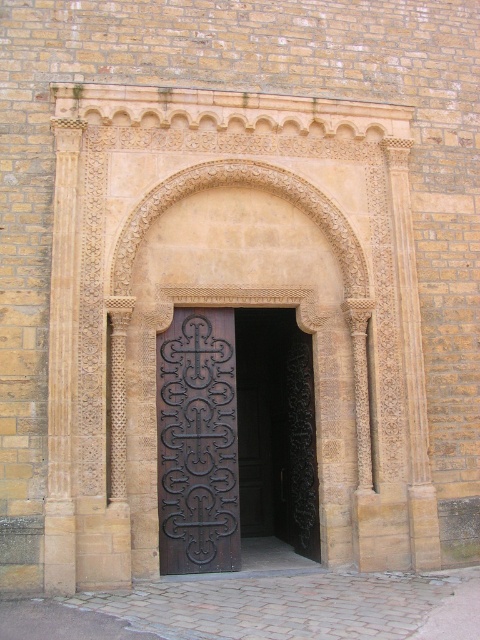
Looking at this image, you are standing at the entrance of the historical building and want to enter. The dark wood door at center and the dark brown wrought iron door at center are both in front of you. Which door should you approach first to enter the building?

You should approach the dark wood door at center first because it is closer to you than the dark brown wrought iron door at center.

You are standing in front of the entrance and need to open the door. Which door should you push to enter? The dark wood door at center or the dark brown wrought iron door at center?

The dark wood door at center is to the right of dark brown wrought iron door at center. Since both doors are at the center, you should push the dark wood door at center as it is the actual door to enter, while the dark brown wrought iron door at center might be a decorative element.